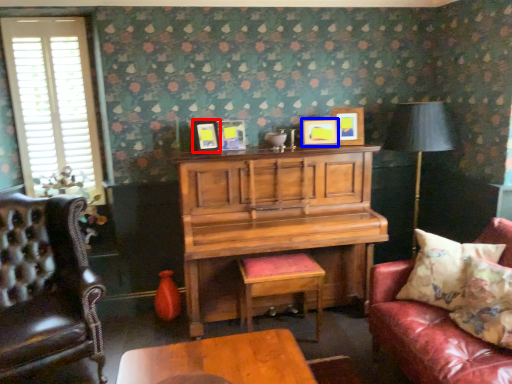
Question: Which point is closer to the camera, picture frame (highlighted by a red box) or picture frame (highlighted by a blue box)?

Choices:
 (A) picture frame
 (B) picture frame

Answer: (A)